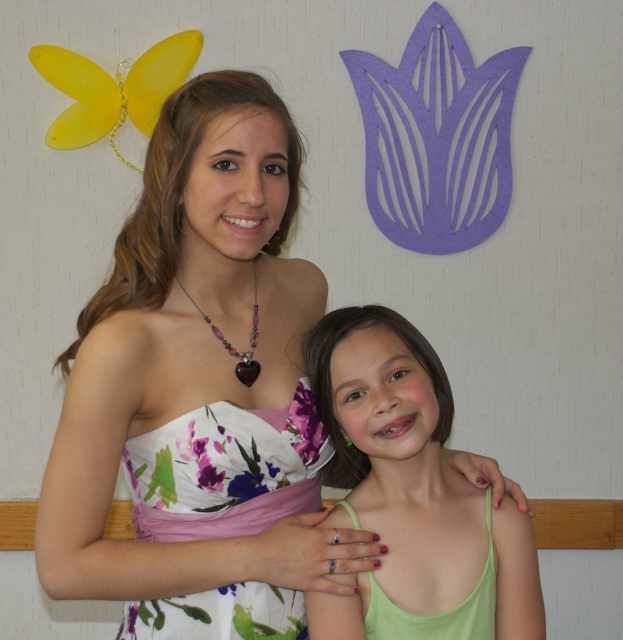
Question: Which object is the farthest from the white floral dress at center?

Choices:
 (A) green matte tank top at center
 (B) green fabric dress at lower center

Answer: (B)

Question: Among these points, which one is nearest to the camera?

Choices:
 (A) (300, 600)
 (B) (439, 552)
 (C) (490, 515)

Answer: (B)

Question: Can you confirm if green matte tank top at center is positioned below green fabric dress at lower center?

Choices:
 (A) no
 (B) yes

Answer: (A)

Question: Which object appears closest to the camera in this image?

Choices:
 (A) green fabric dress at lower center
 (B) white floral dress at center
 (C) green matte tank top at center
 (D) floral silk dress at center

Answer: (B)

Question: Is white floral dress at center below floral silk dress at center?

Choices:
 (A) no
 (B) yes

Answer: (A)

Question: Does white floral dress at center appear on the right side of floral silk dress at center?

Choices:
 (A) no
 (B) yes

Answer: (B)